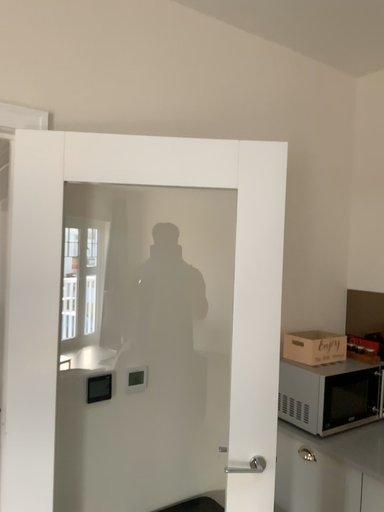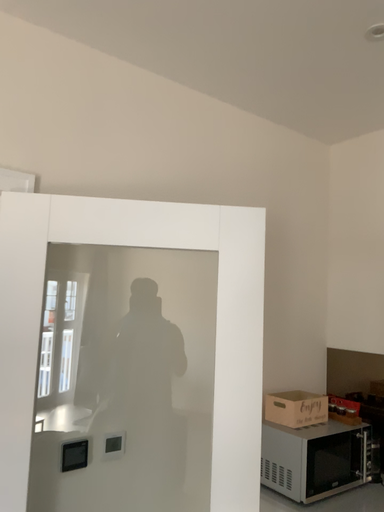
Question: How did the camera likely rotate when shooting the video?

Choices:
 (A) rotated downward
 (B) rotated upward

Answer: (B)